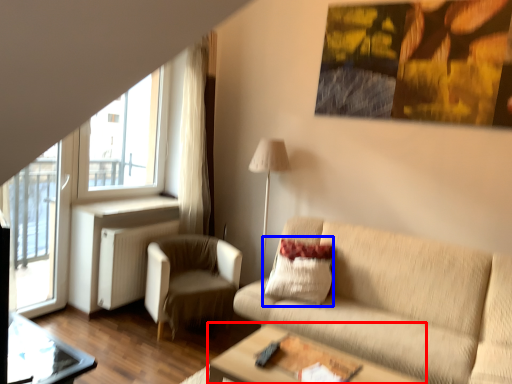
Question: Which object is further to the camera taking this photo, table (highlighted by a red box) or pillow (highlighted by a blue box)?

Choices:
 (A) table
 (B) pillow

Answer: (B)